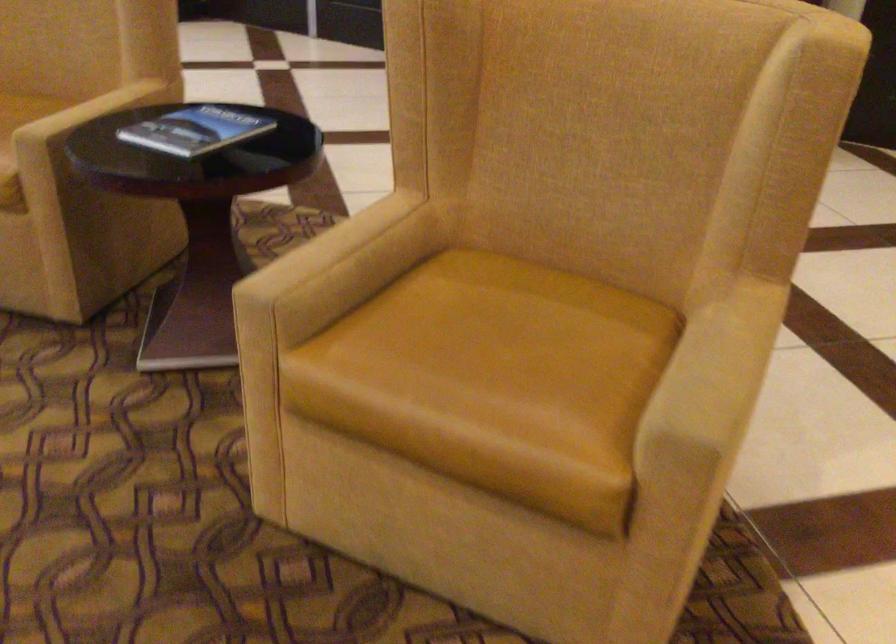
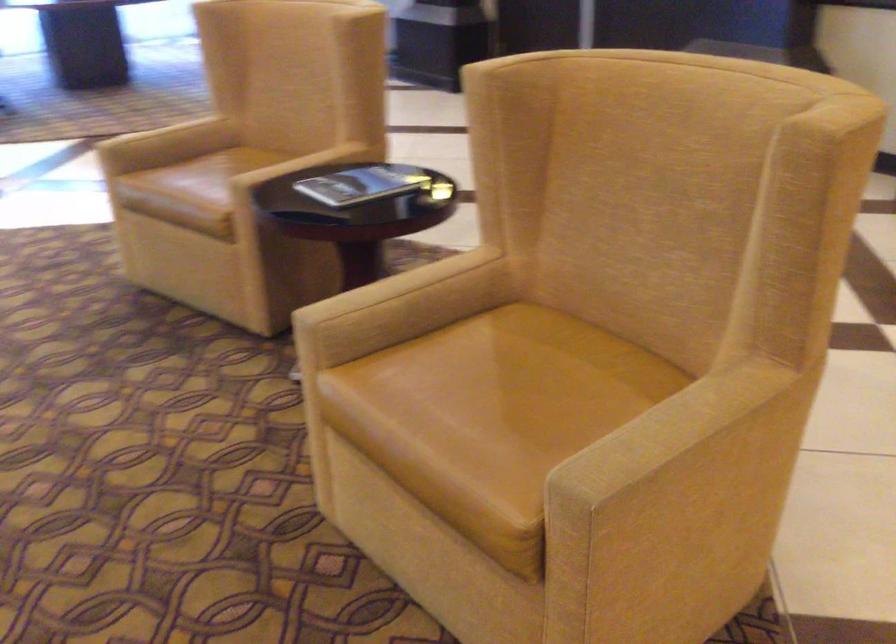
Question: The images are taken continuously from a first-person perspective. In which direction is your viewpoint rotating?

Choices:
 (A) Left
 (B) Right
 (C) Up
 (D) Down

Answer: (A)